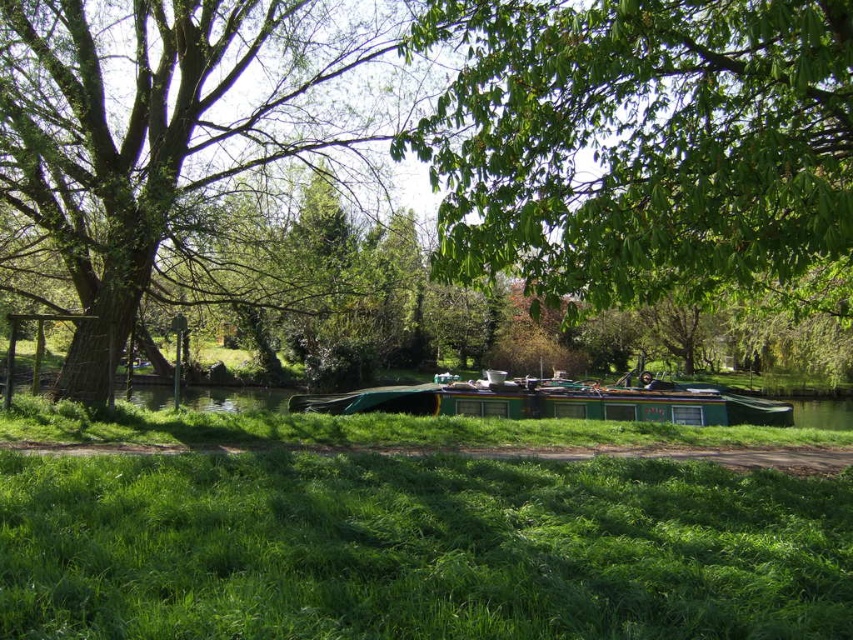
Question: Is green leafy tree at left further to camera compared to green matte boat at center?

Choices:
 (A) yes
 (B) no

Answer: (B)

Question: Which object is closer to the camera taking this photo?

Choices:
 (A) green matte boat at center
 (B) green leafy tree at left

Answer: (B)

Question: Is green leafy tree at left bigger than green matte boat at center?

Choices:
 (A) no
 (B) yes

Answer: (A)

Question: Is the position of green leafy tree at left less distant than that of green matte boat at center?

Choices:
 (A) yes
 (B) no

Answer: (A)